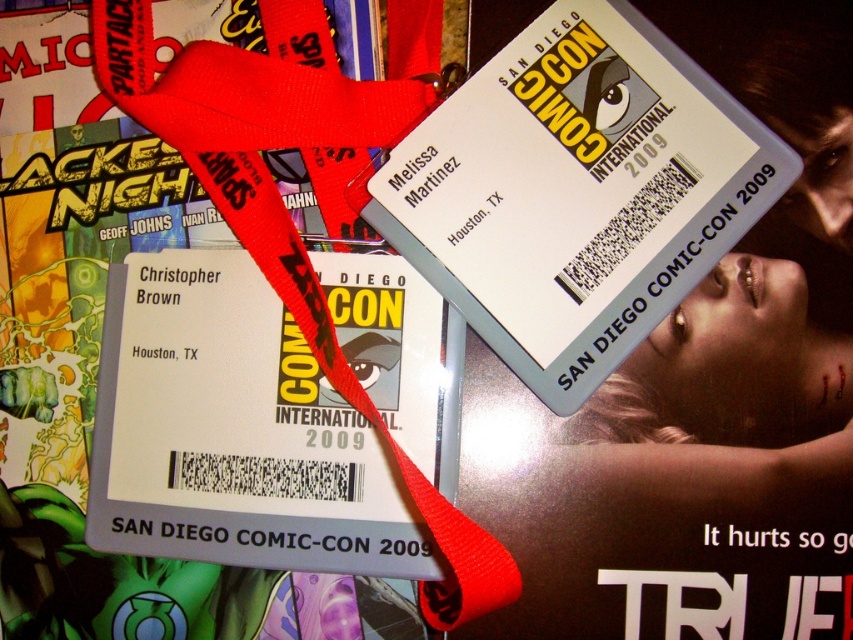
Does point (537, 355) lie behind point (393, 486)?

Yes, point (537, 355) is farther from viewer.

Does white plastic badge at center have a greater height compared to white cardstock ticket at center?

Correct, white plastic badge at center is much taller as white cardstock ticket at center.

The height and width of the screenshot is (640, 853). Identify the location of white plastic badge at center. [x=576, y=193].